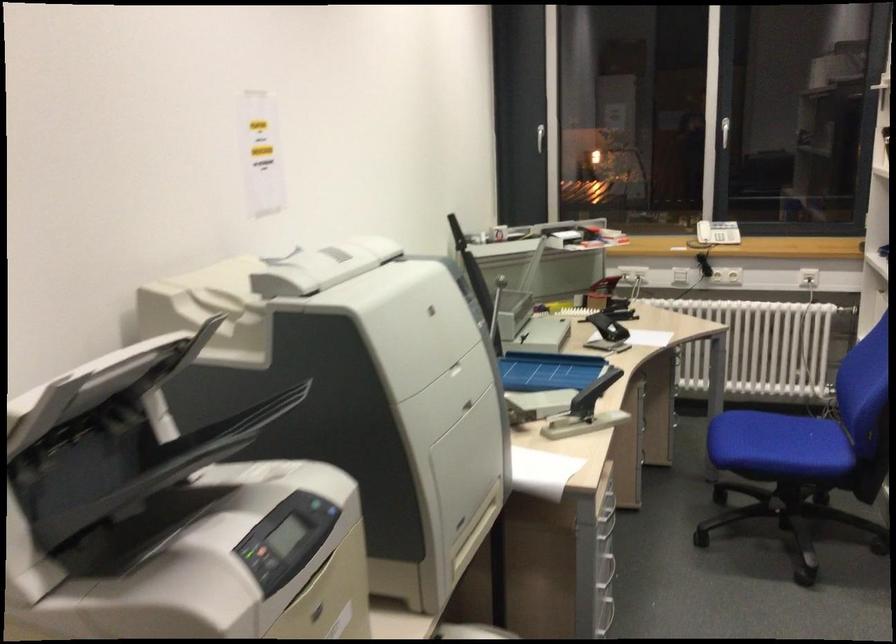
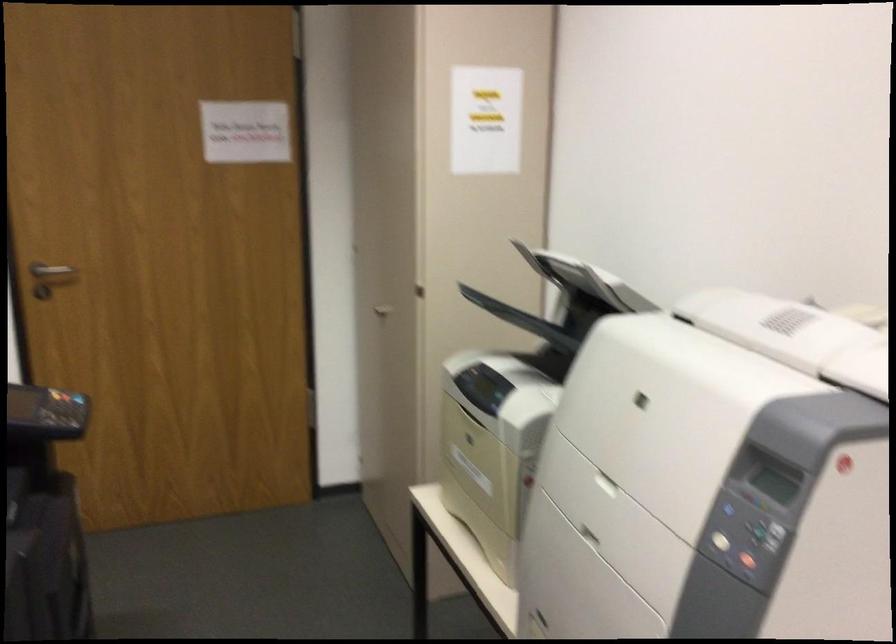
Locate, in the second image, the point that corresponds to the point at 448,325 in the first image.

(754, 524)